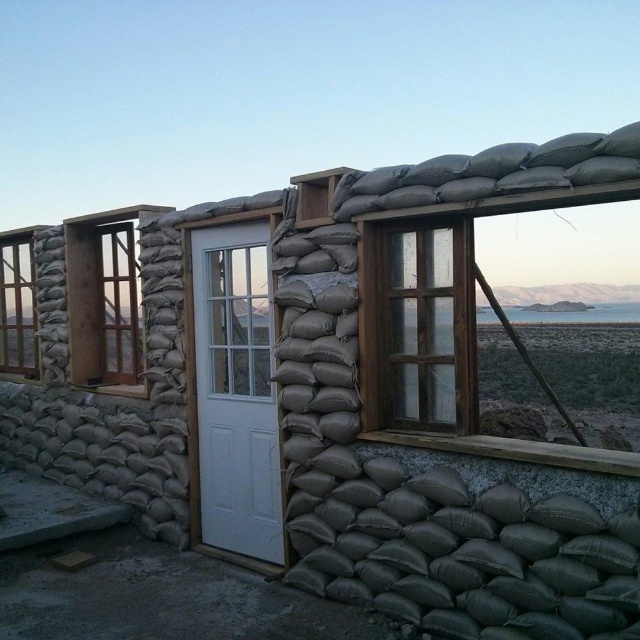
You are standing in front of the sandbag structure and want to know what is located at the coordinates point [458,333]. What object is exactly at that point?

The wooden framed glass window at upper center is located at point [458,333].

You are standing in front of the sandbag structure and see a point marked at coordinates (236, 390). Based on the scene description, which object does this point belong to?

The point at coordinates (236, 390) is on the white matte door at center.